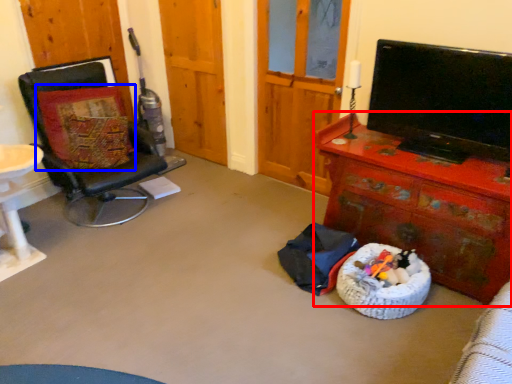
Question: Among these objects, which one is farthest to the camera, desk (highlighted by a red box) or pillow (highlighted by a blue box)?

Choices:
 (A) desk
 (B) pillow

Answer: (B)